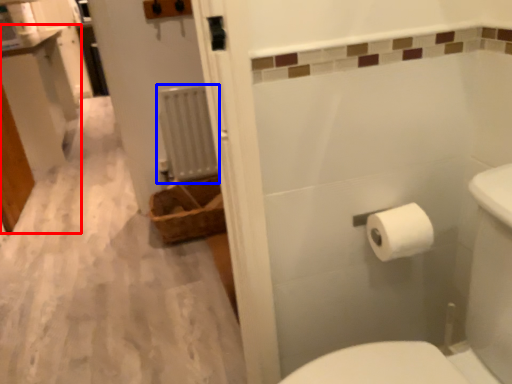
Question: Which of the following is the farthest to the observer, vanity (highlighted by a red box) or radiator (highlighted by a blue box)?

Choices:
 (A) vanity
 (B) radiator

Answer: (A)